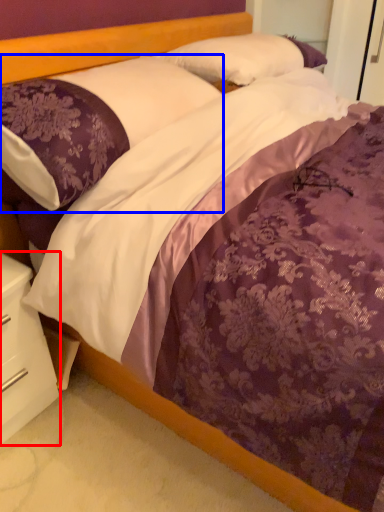
Question: Which object is further to the camera taking this photo, nightstand (highlighted by a red box) or pillow (highlighted by a blue box)?

Choices:
 (A) nightstand
 (B) pillow

Answer: (A)